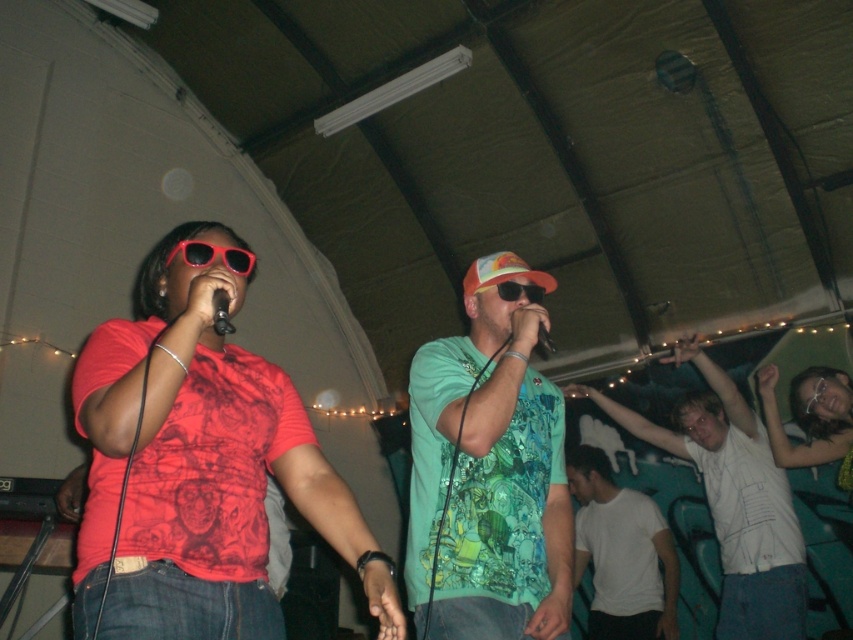
Which is more to the left, white cotton shirt at lower right or white matte t-shirt at lower right?

Positioned to the left is white matte t-shirt at lower right.

Locate an element on the screen. white cotton shirt at lower right is located at coordinates (733, 499).

What do you see at coordinates (733, 499) in the screenshot? The width and height of the screenshot is (853, 640). I see `white cotton shirt at lower right` at bounding box center [733, 499].

At what (x,y) coordinates should I click in order to perform the action: click on white cotton shirt at lower right. Please return your answer as a coordinate pair (x, y). Looking at the image, I should click on (733, 499).

Is green printed t-shirt at center wider than white matte t-shirt at lower right?

No.

Which of these two, green printed t-shirt at center or white matte t-shirt at lower right, stands taller?

With more height is white matte t-shirt at lower right.

Measure the distance between green printed t-shirt at center and camera.

They are 1.82 meters apart.

Image resolution: width=853 pixels, height=640 pixels. I want to click on green printed t-shirt at center, so click(489, 472).

Measure the distance from white cotton shirt at lower right to black matte microphone at center.

white cotton shirt at lower right and black matte microphone at center are 2.41 meters apart.

Can you confirm if white cotton shirt at lower right is thinner than black matte microphone at center?

In fact, white cotton shirt at lower right might be wider than black matte microphone at center.

Is point (722, 474) positioned before point (213, 321)?

No, it is behind (213, 321).

In order to click on white cotton shirt at lower right in this screenshot , I will do `click(733, 499)`.